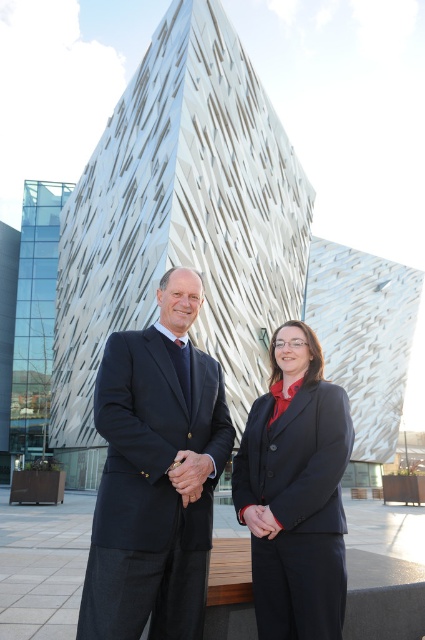
Question: Is matte black suit at center bigger than matte black blazer at center?

Choices:
 (A) no
 (B) yes

Answer: (B)

Question: Which point is closer to the camera?

Choices:
 (A) (339, 481)
 (B) (275, 346)

Answer: (A)

Question: Is matte black suit at center to the right of matte black blazer at center from the viewer's perspective?

Choices:
 (A) yes
 (B) no

Answer: (B)

Question: Which is nearer to the dark blue wool suit at center?

Choices:
 (A) matte black blazer at center
 (B) matte black suit at center

Answer: (B)

Question: Does matte black suit at center appear on the left side of matte black blazer at center?

Choices:
 (A) yes
 (B) no

Answer: (A)

Question: Which point appears closest to the camera in this image?

Choices:
 (A) (328, 412)
 (B) (167, 584)

Answer: (B)